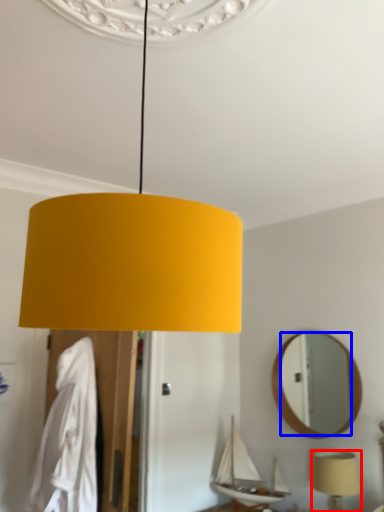
Question: Among these objects, which one is farthest to the camera, lamp (highlighted by a red box) or mirror (highlighted by a blue box)?

Choices:
 (A) lamp
 (B) mirror

Answer: (B)